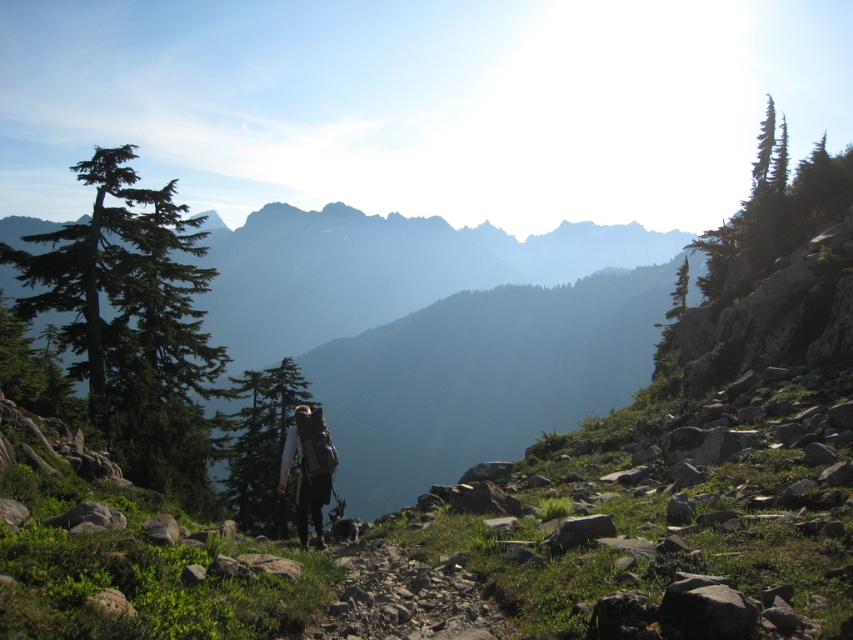
Question: Among these points, which one is nearest to the camera?

Choices:
 (A) (222, 481)
 (B) (315, 532)
 (C) (618, 397)
 (D) (677, 298)

Answer: (B)

Question: Which point is farther to the camera?

Choices:
 (A) green matte tree at center
 (B) green grassy mountain at center
 (C) gray fabric backpack at center

Answer: (B)

Question: Is green textured pine tree at upper right above green matte tree at center?

Choices:
 (A) yes
 (B) no

Answer: (A)

Question: Is the position of green matte tree at center less distant than that of green textured tree at upper right?

Choices:
 (A) no
 (B) yes

Answer: (B)

Question: Which is nearer to the green textured tree at upper right?

Choices:
 (A) green matte evergreen tree at left
 (B) green matte tree at center
 (C) green textured pine tree at upper right

Answer: (C)

Question: Is gray fabric backpack at center above green textured tree at upper right?

Choices:
 (A) no
 (B) yes

Answer: (A)